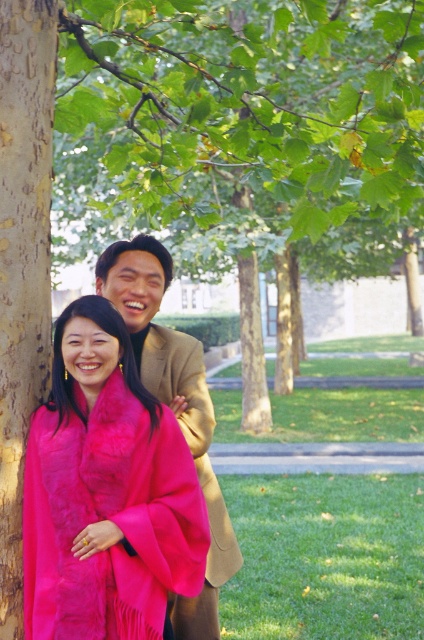
Between green leafy tree at center and tan wool coat at center, which one has more height?

With more height is green leafy tree at center.

Does green leafy tree at center have a smaller size compared to tan wool coat at center?

No, green leafy tree at center is not smaller than tan wool coat at center.

Which is in front, point (273, 83) or point (180, 625)?

Positioned in front is point (180, 625).

Identify the location of green leafy tree at center. (243, 131).

How much distance is there between green leafy tree at center and fuzzy pink scarf at left?

The distance of green leafy tree at center from fuzzy pink scarf at left is 3.90 meters.

Does green leafy tree at center appear on the left side of fuzzy pink scarf at left?

No, green leafy tree at center is not to the left of fuzzy pink scarf at left.

The height and width of the screenshot is (640, 424). I want to click on green leafy tree at center, so click(x=243, y=131).

At what (x,y) coordinates should I click in order to perform the action: click on green leafy tree at center. Please return your answer as a coordinate pair (x, y). The image size is (424, 640). Looking at the image, I should click on (243, 131).

Is fuzzy pink scarf at left taller than smooth bark tree trunk at left?

No.

Is fuzzy pink scarf at left bigger than smooth bark tree trunk at left?

Indeed, fuzzy pink scarf at left has a larger size compared to smooth bark tree trunk at left.

I want to click on fuzzy pink scarf at left, so click(x=106, y=492).